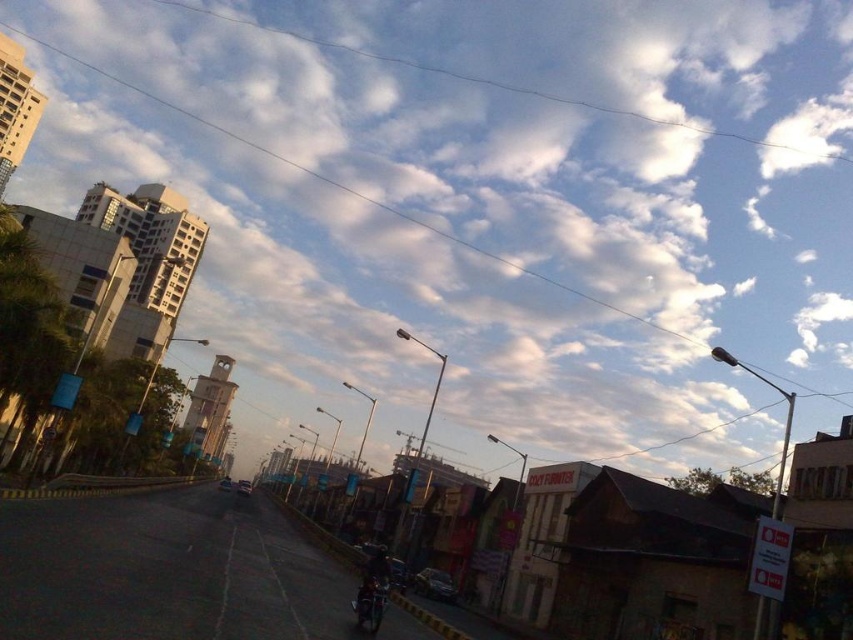
Question: Which of the following is the closest to the observer?

Choices:
 (A) shiny metallic motorcycle at center
 (B) white fluffy cloud at upper center

Answer: (A)

Question: Can you confirm if white fluffy cloud at upper center is positioned to the left of shiny metallic motorcycle at center?

Choices:
 (A) no
 (B) yes

Answer: (A)

Question: Which of the following is the farthest from the observer?

Choices:
 (A) white fluffy cloud at upper center
 (B) shiny metallic motorcycle at center

Answer: (A)

Question: Among these objects, which one is nearest to the camera?

Choices:
 (A) shiny metallic motorcycle at center
 (B) white fluffy cloud at upper center

Answer: (A)

Question: Is white fluffy cloud at upper center in front of shiny metallic motorcycle at center?

Choices:
 (A) no
 (B) yes

Answer: (A)

Question: Can you confirm if white fluffy cloud at upper center is positioned to the right of shiny metallic motorcycle at center?

Choices:
 (A) no
 (B) yes

Answer: (B)